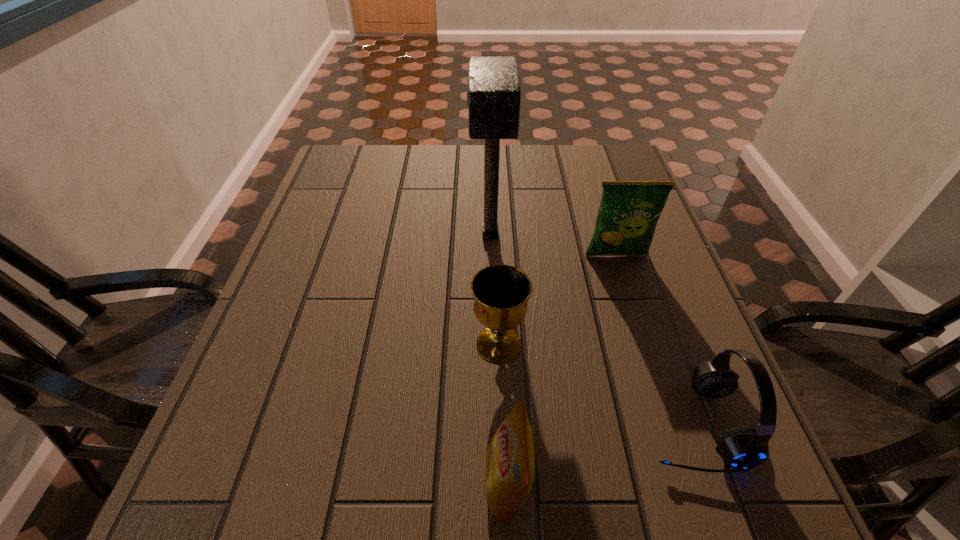
In order to click on vacant space located 0.330m on the ear cushions of the headset in this screenshot , I will do `click(455, 424)`.

I want to click on free location located 0.220m on the ear cushions of the headset, so click(518, 424).

Image resolution: width=960 pixels, height=540 pixels. I want to click on vacant space located 0.390m on the ear cushions of the headset, so tap(420, 424).

The width and height of the screenshot is (960, 540). What are the coordinates of `vacant area situated on the front-facing side of the shorter crisp (potato chip)` in the screenshot? It's located at (271, 484).

Where is `free space located 0.220m on the front-facing side of the shorter crisp (potato chip)`? free space located 0.220m on the front-facing side of the shorter crisp (potato chip) is located at coordinates (347, 484).

You are a GUI agent. You are given a task and a screenshot of the screen. Output one action in this format:
    pyautogui.click(x=<x>, y=<y>)
    Task: Click on the blank area located 0.280m on the front-facing side of the shorter crisp (potato chip)
    This screenshot has height=540, width=960.
    Given the screenshot: What is the action you would take?
    pyautogui.click(x=309, y=484)

Where is `headset positioned at the near edge`? This screenshot has height=540, width=960. headset positioned at the near edge is located at coordinates (740, 447).

Find the location of a particular element. crisp (potato chip) that is positioned at the near edge is located at coordinates (509, 459).

Where is `crisp (potato chip) that is at the right edge`? The image size is (960, 540). crisp (potato chip) that is at the right edge is located at coordinates (629, 211).

The image size is (960, 540). What are the coordinates of `headset that is at the right edge` in the screenshot? It's located at (740, 447).